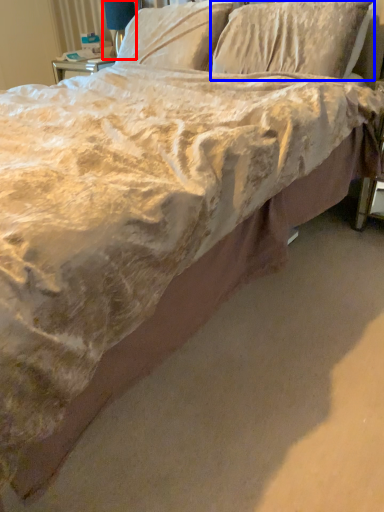
Question: Which object appears closest to the camera in this image, table lamp (highlighted by a red box) or pillow (highlighted by a blue box)?

Choices:
 (A) table lamp
 (B) pillow

Answer: (B)